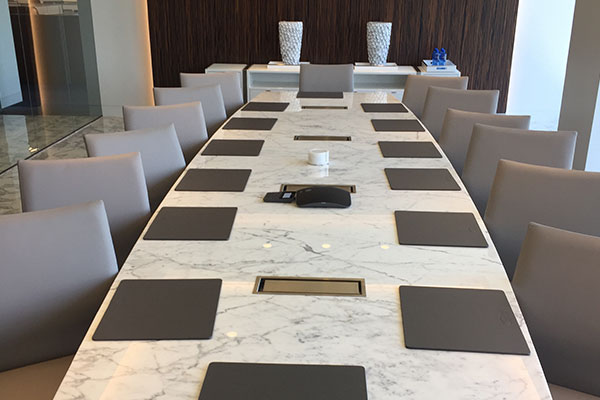
Identify the location of white wall/blank. point(132,42).